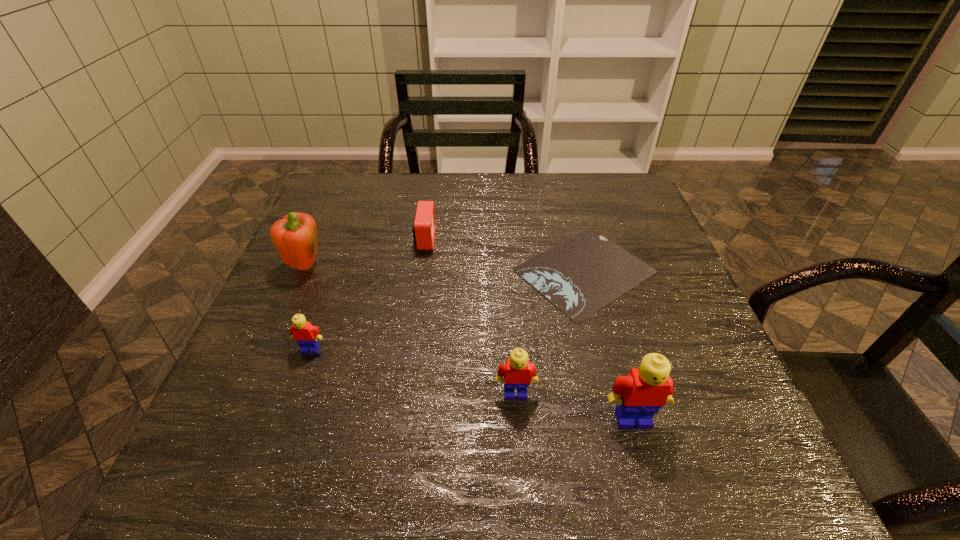
I want to click on free location at the left edge, so click(233, 372).

The height and width of the screenshot is (540, 960). What are the coordinates of `vacant space at the right edge of the desktop` in the screenshot? It's located at (632, 219).

This screenshot has width=960, height=540. I want to click on free space at the far left corner of the desktop, so click(365, 179).

In the image, there is a desktop. Where is `vacant space at the near left corner`? This screenshot has width=960, height=540. vacant space at the near left corner is located at coordinates (260, 424).

In the image, there is a desktop. Where is `free space at the near right corner`? free space at the near right corner is located at coordinates click(x=728, y=422).

Locate an element on the screen. The height and width of the screenshot is (540, 960). unoccupied position between the second nearest object and the alarm clock is located at coordinates (470, 316).

You are a GUI agent. You are given a task and a screenshot of the screen. Output one action in this format:
    pyautogui.click(x=<x>, y=<y>)
    Task: Click on the free spot between the second Lego from left to right and the fourth object from right to left
    The width and height of the screenshot is (960, 540).
    Given the screenshot: What is the action you would take?
    pyautogui.click(x=470, y=316)

Where is `free space between the mousepad and the alarm clock`? Image resolution: width=960 pixels, height=540 pixels. free space between the mousepad and the alarm clock is located at coordinates (505, 255).

The height and width of the screenshot is (540, 960). Find the location of `blank region between the shortest object and the second shortest Lego`. blank region between the shortest object and the second shortest Lego is located at coordinates (550, 332).

The image size is (960, 540). Identify the location of vacant space in between the shortest object and the fifth farthest object. (550, 332).